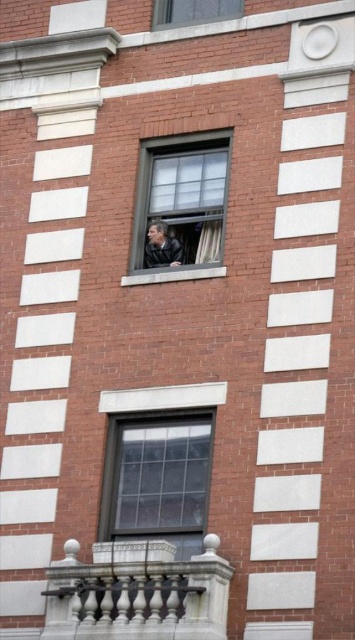
You are a window cleaner standing at the base of the building. You need to clean both the dark gray leather jacket at center and the white sheer curtain at center. Which one is closer to you?

The dark gray leather jacket at center is shorter than the white sheer curtain at center, so the dark gray leather jacket at center is closer to you.

You are standing in front of the brick building and notice two items at the center of the facade. One is a dark gray leather jacket at center and the other is a white sheer curtain at center. Which one is positioned higher up?

The white sheer curtain at center is positioned higher up because the dark gray leather jacket at center is located below it.

You are standing in front of the brick building and notice the dark gray leather jacket at center and the white sheer curtain at center. Which object is positioned to the left?

The dark gray leather jacket at center is to the left of the white sheer curtain at center.